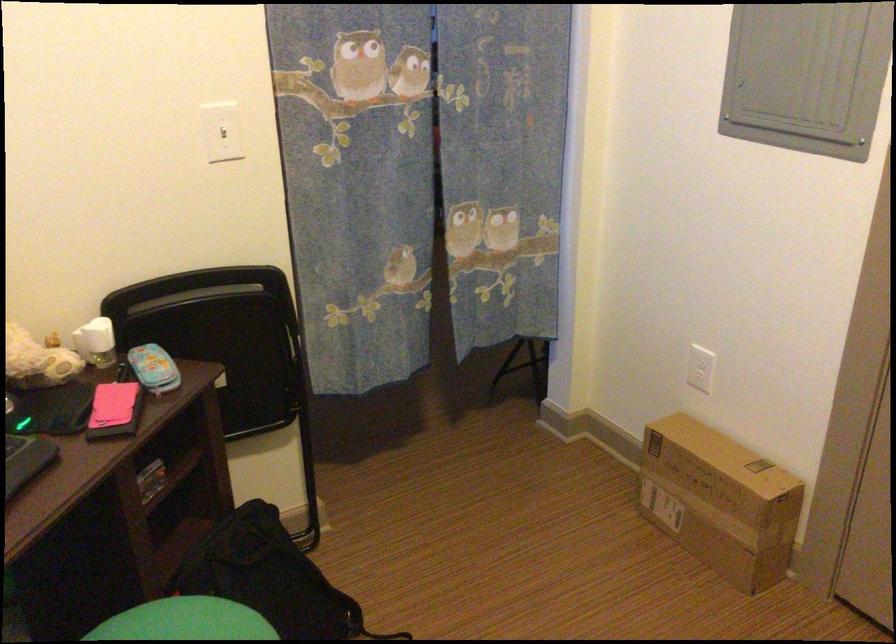
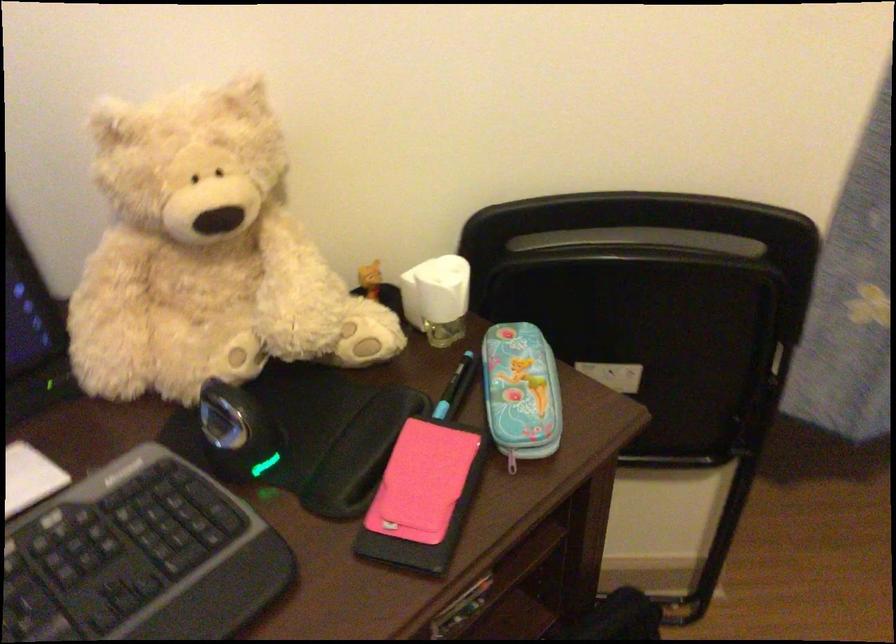
In the scene shown: First-person continuous shooting, in which direction is the camera rotating?

The rotation direction of the camera is left-down.